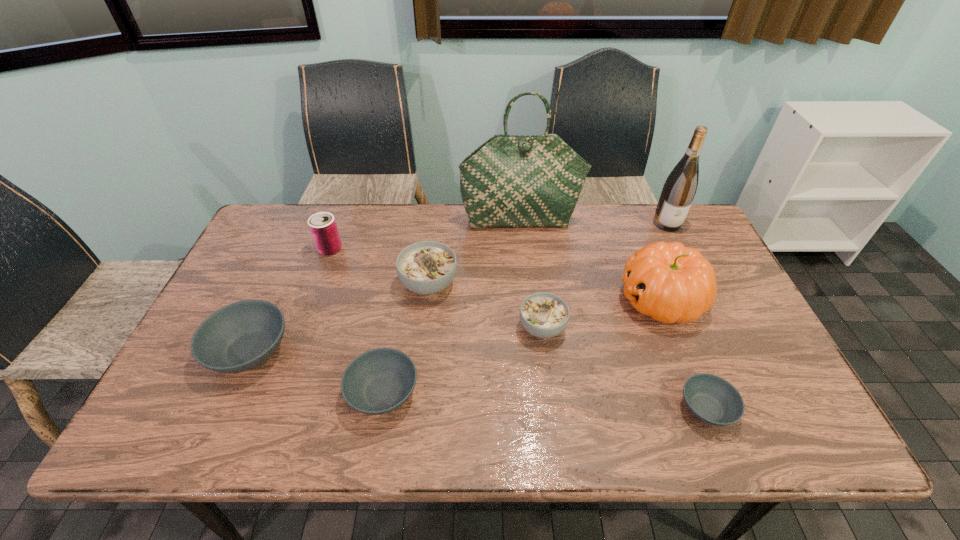
The height and width of the screenshot is (540, 960). I want to click on free space at the left edge, so click(x=238, y=290).

Identify the location of vacant position at the right edge of the desktop. The height and width of the screenshot is (540, 960). (714, 308).

You are a GUI agent. You are given a task and a screenshot of the screen. Output one action in this format:
    pyautogui.click(x=<x>, y=<y>)
    Task: Click on the vacant space at the far left corner of the desktop
    This screenshot has height=540, width=960.
    Given the screenshot: What is the action you would take?
    pyautogui.click(x=253, y=247)

What are the coordinates of `free space between the second shortest object and the smaller white soup bowl` in the screenshot? It's located at (463, 360).

Identify the location of unoccupied area between the pumpkin and the second smallest gray soup bowl. The width and height of the screenshot is (960, 540). [x=522, y=346].

This screenshot has width=960, height=540. Identify the location of vacant area that lies between the smallest gray soup bowl and the tote bag. (613, 314).

Locate an element on the screen. empty space that is in between the farther white soup bowl and the second soup bowl from right to left is located at coordinates (486, 306).

In order to click on vacant point located between the wine bottle and the can in this screenshot , I will do `click(498, 236)`.

The height and width of the screenshot is (540, 960). I want to click on blank region between the green tote bag and the leftmost gray soup bowl, so click(x=385, y=286).

In order to click on empty space between the smallest gray soup bowl and the leftmost gray soup bowl in this screenshot , I will do `click(478, 380)`.